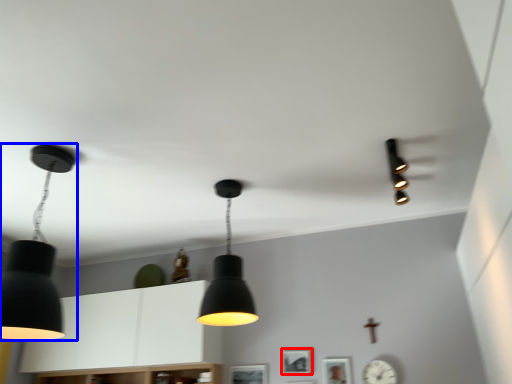
Question: Which of the following is the farthest to the observer, picture frame (highlighted by a red box) or lamp (highlighted by a blue box)?

Choices:
 (A) picture frame
 (B) lamp

Answer: (A)